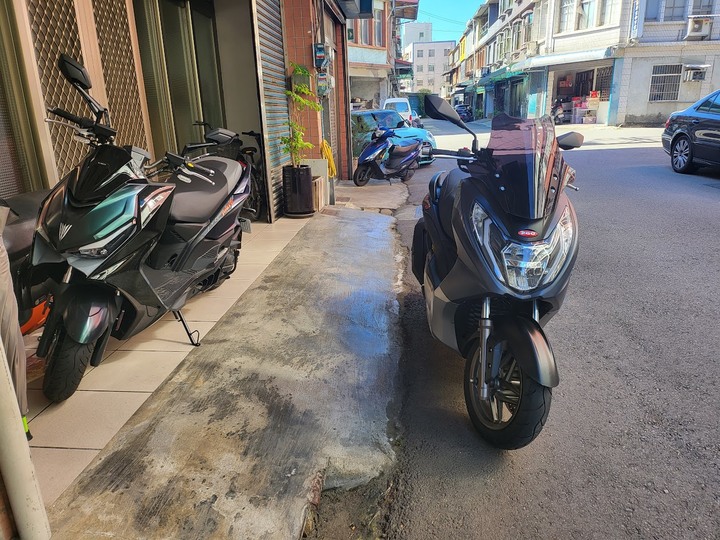
Where is `plant`? The width and height of the screenshot is (720, 540). plant is located at coordinates (292, 137), (301, 87).